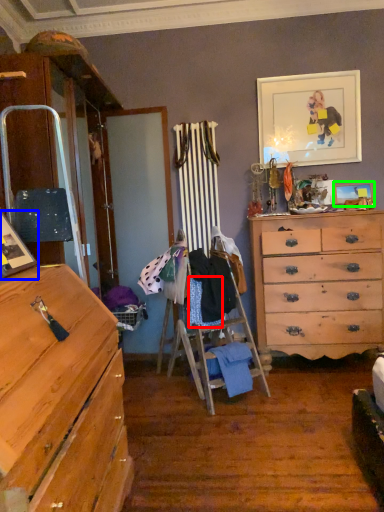
Question: Which object is the farthest from clothing (highlighted by a red box)? Choose among these: picture frame (highlighted by a blue box) or picture frame (highlighted by a green box).

Choices:
 (A) picture frame
 (B) picture frame

Answer: (B)